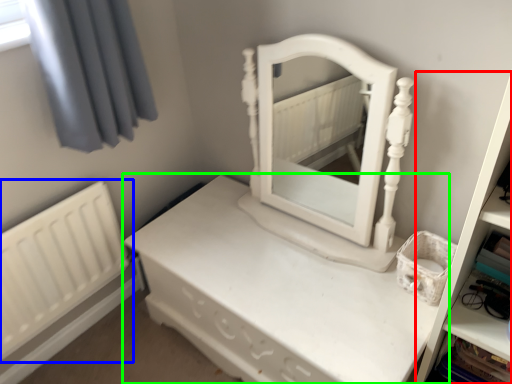
Question: Which is nearer to the bookshelf (highlighted by a red box)? radiator (highlighted by a blue box) or nightstand (highlighted by a green box).

Choices:
 (A) radiator
 (B) nightstand

Answer: (B)